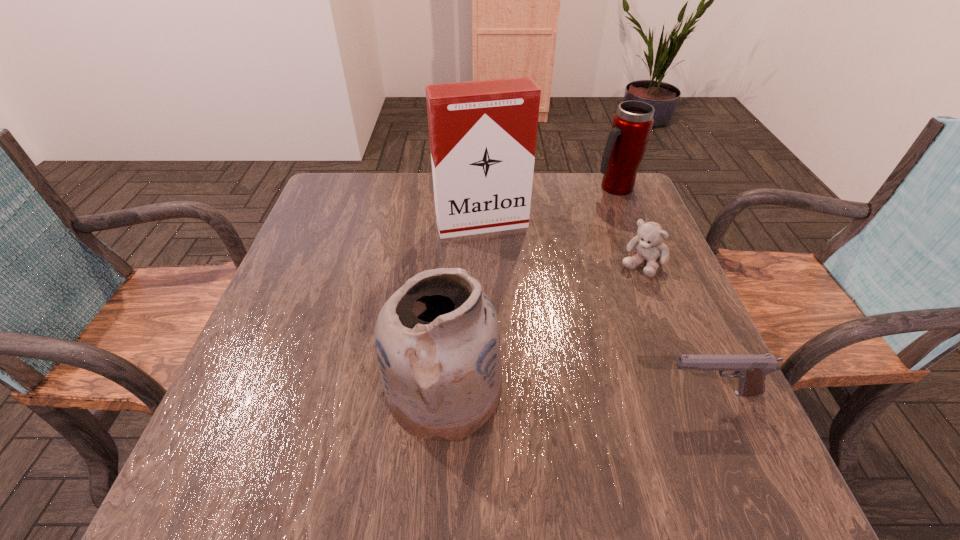
The image size is (960, 540). I want to click on vacant spot on the desktop that is between the pottery and the pistol and is positioned on the face of the teddy bear, so [x=543, y=391].

Locate an element on the screen. This screenshot has width=960, height=540. free space on the desktop that is between the pottery and the pistol and is positioned on the side with the handle of the farthest object is located at coordinates (587, 392).

Image resolution: width=960 pixels, height=540 pixels. In order to click on vacant space on the desktop that is between the pottery and the pistol and is positioned on the front-facing side of the tallest object in this screenshot , I will do `click(540, 391)`.